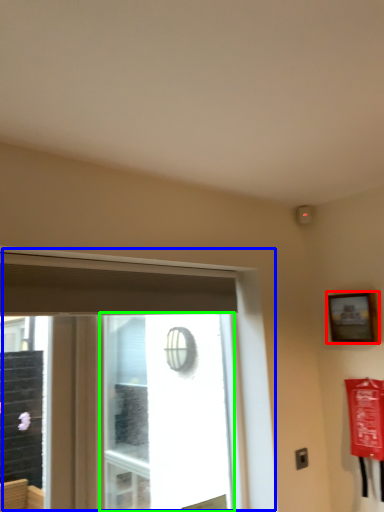
Question: Which is farther away from picture frame (highlighted by a red box)? window (highlighted by a blue box) or window screen (highlighted by a green box)?

Choices:
 (A) window
 (B) window screen

Answer: (B)